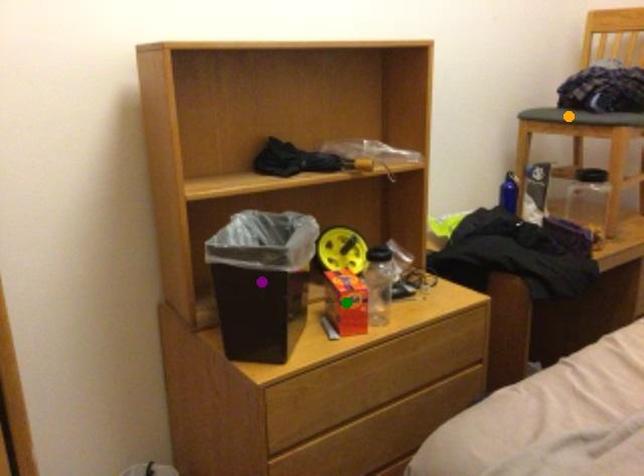
Order these from nearest to farthest:
green point, orange point, purple point

green point
purple point
orange point